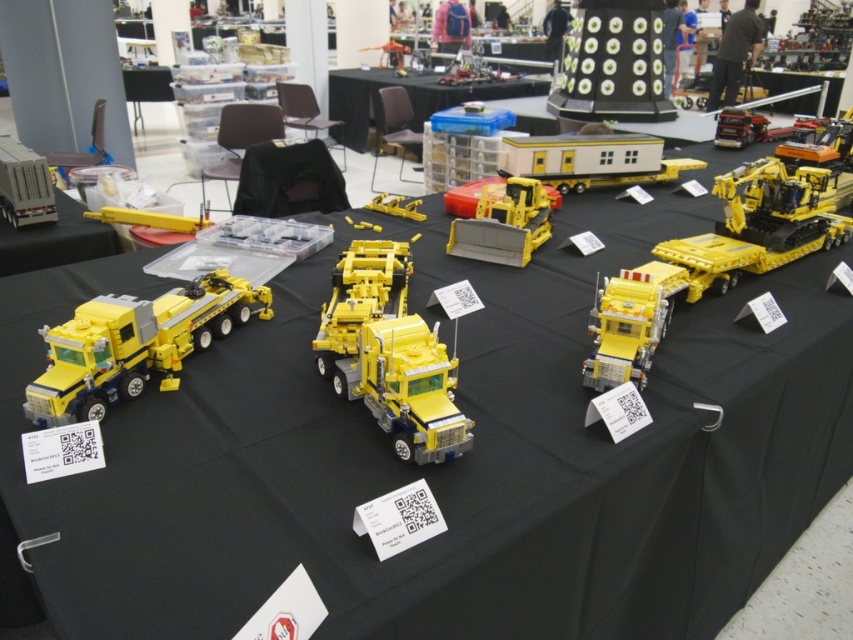
Question: Is matte yellow truck at left further to the viewer compared to matte gray truck at left?

Choices:
 (A) no
 (B) yes

Answer: (A)

Question: Is black plastic target at upper right thinner than yellow plastic truck at center?

Choices:
 (A) no
 (B) yes

Answer: (A)

Question: Which point appears farthest from the camera in this image?

Choices:
 (A) (410, 211)
 (B) (625, 278)
 (C) (190, 292)

Answer: (A)

Question: Among these points, which one is farthest from the camera?

Choices:
 (A) (345, 348)
 (B) (3, 138)
 (C) (567, 177)
 (D) (543, 211)

Answer: (B)

Question: Which point is farther from the camera taking this photo?

Choices:
 (A) (180, 301)
 (B) (480, 208)
 (C) (502, 168)
 (D) (624, 54)

Answer: (D)

Question: Is yellow plastic truck at center positioned in front of shiny yellow truck at center?

Choices:
 (A) yes
 (B) no

Answer: (A)